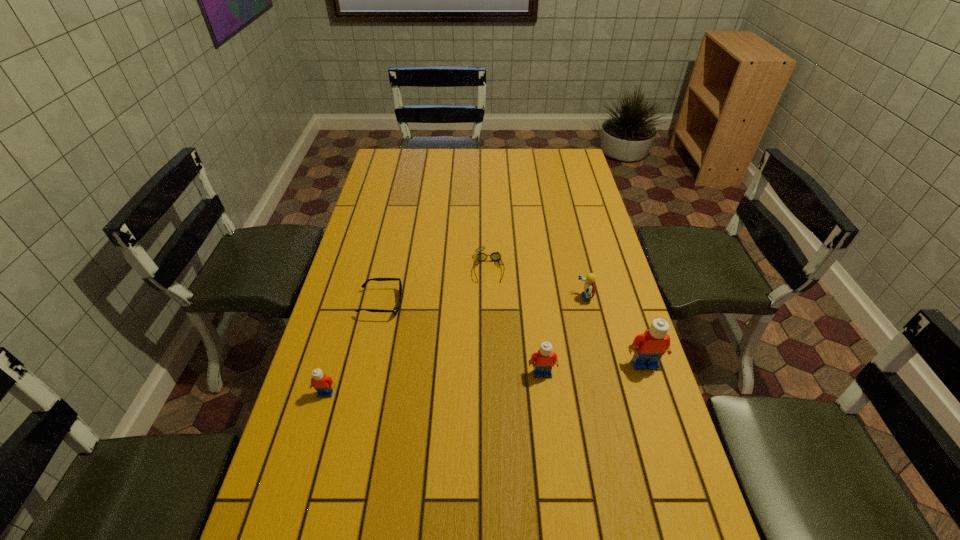
This screenshot has width=960, height=540. In order to click on free area in between the second Lego from right to left and the second tallest object in this screenshot , I will do `click(564, 335)`.

This screenshot has height=540, width=960. I want to click on free space between the third Lego from left to right and the fourth object from right to left, so click(537, 282).

The height and width of the screenshot is (540, 960). Identify the location of free space between the third shortest Lego and the farthest Lego. (564, 335).

Locate an element on the screen. The height and width of the screenshot is (540, 960). empty space between the tallest object and the sunglasses is located at coordinates (513, 334).

At what (x,y) coordinates should I click in order to perform the action: click on free space between the fourth object from left to right and the tallest object. Please return your answer as a coordinate pair (x, y). The height and width of the screenshot is (540, 960). Looking at the image, I should click on (593, 368).

Locate an element on the screen. The image size is (960, 540). vacant space in between the fifth object from left to right and the spectacles is located at coordinates (537, 282).

Identify the location of free space between the nearest Lego and the rightmost object. The width and height of the screenshot is (960, 540). (485, 379).

You are a GUI agent. You are given a task and a screenshot of the screen. Output one action in this format:
    pyautogui.click(x=<x>, y=<y>)
    Task: Click on the object that is the fifth closest to the third Lego from left to right
    The width and height of the screenshot is (960, 540).
    Given the screenshot: What is the action you would take?
    pyautogui.click(x=323, y=384)

At what (x,y) coordinates should I click in order to perform the action: click on object that ranks as the third closest to the spectacles. Please return your answer as a coordinate pair (x, y). The image size is (960, 540). Looking at the image, I should click on (544, 359).

Where is `the fourth closest Lego to the sunglasses`? The height and width of the screenshot is (540, 960). the fourth closest Lego to the sunglasses is located at coordinates (648, 348).